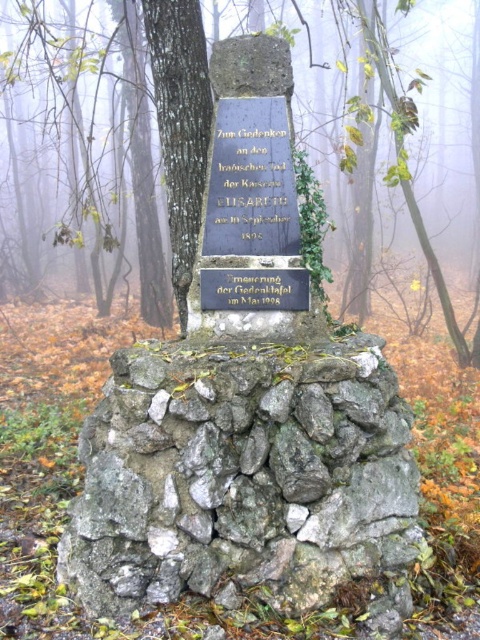
You are a tourist standing in front of the monument and want to take a photo that includes both the dark gray stone monument at center and the black stone plaque at center. Which object should you focus on first to ensure both are in the frame?

The dark gray stone monument at center is much taller than the black stone plaque at center, so you should focus on the dark gray stone monument at center first to ensure both are in the frame.

You are a tourist visiting a historical site in the misty forest. You see the dark gray stone monument at center and the black stone plaque at center. According to their positions, which one is located to the right of the other?

The dark gray stone monument at center is positioned on the right side of the black stone plaque at center.